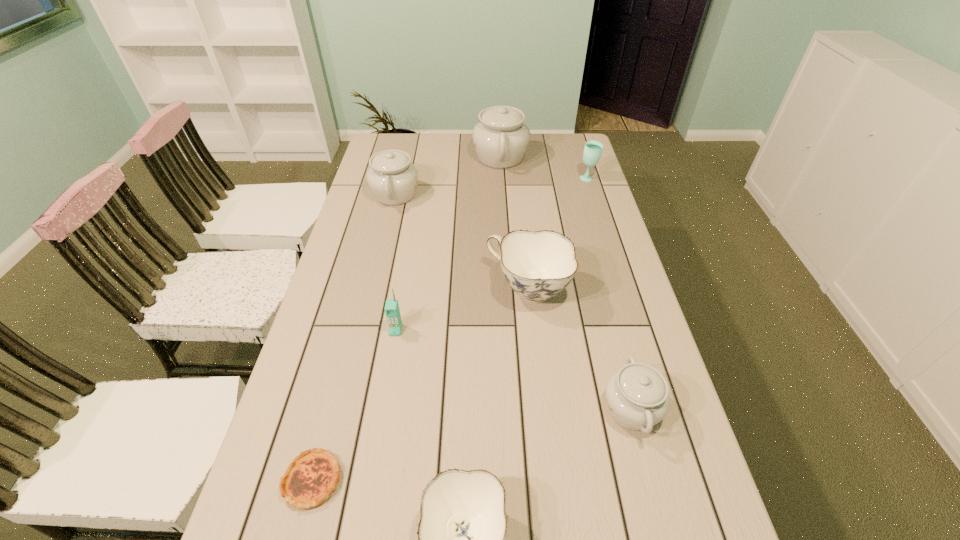
In order to click on quiche at the left edge in this screenshot , I will do `click(311, 477)`.

The height and width of the screenshot is (540, 960). Find the location of `glass located at the right edge`. glass located at the right edge is located at coordinates (593, 149).

You are a GUI agent. You are given a task and a screenshot of the screen. Output one action in this format:
    pyautogui.click(x=<x>, y=<y>)
    Task: Click on the chinaware located in the right edge section of the desktop
    
    Given the screenshot: What is the action you would take?
    pyautogui.click(x=637, y=396)

The image size is (960, 540). I want to click on vacant space at the left edge, so click(356, 261).

I want to click on vacant space at the right edge, so click(x=599, y=232).

In order to click on unoccupied position between the nearest white chinaware and the bigger blue chinaware in this screenshot , I will do `click(580, 349)`.

You are a GUI agent. You are given a task and a screenshot of the screen. Output one action in this format:
    pyautogui.click(x=<x>, y=<y>)
    Task: Click on the empty space that is in between the leftmost white chinaware and the second white chinaware from left to right
    
    Given the screenshot: What is the action you would take?
    pyautogui.click(x=448, y=176)

Image resolution: width=960 pixels, height=540 pixels. In order to click on empty space that is in between the second white chinaware from left to right and the quiche in this screenshot , I will do `click(406, 319)`.

Where is `vacant space in between the shortest object and the smallest white chinaware`? vacant space in between the shortest object and the smallest white chinaware is located at coordinates (471, 444).

I want to click on vacant area that lies between the second smallest white chinaware and the glass, so click(x=492, y=187).